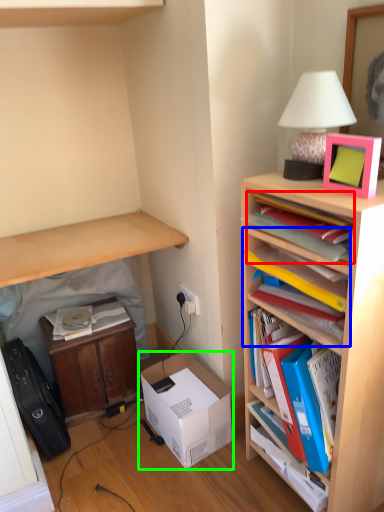
Question: Estimate the real-world distances between objects in this image. Which object is farther from book (highlighted by a red box), shelf (highlighted by a blue box) or box (highlighted by a green box)?

Choices:
 (A) shelf
 (B) box

Answer: (B)